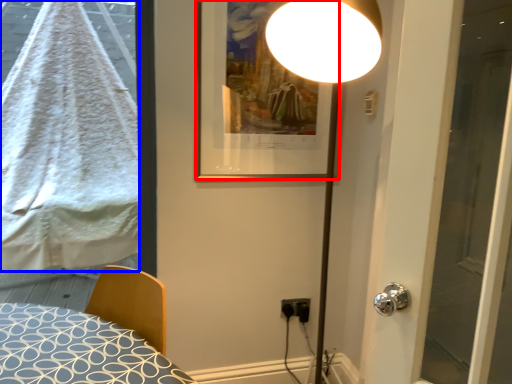
Question: Which point is further to the camera, picture frame (highlighted by a red box) or blanket (highlighted by a blue box)?

Choices:
 (A) picture frame
 (B) blanket

Answer: (B)